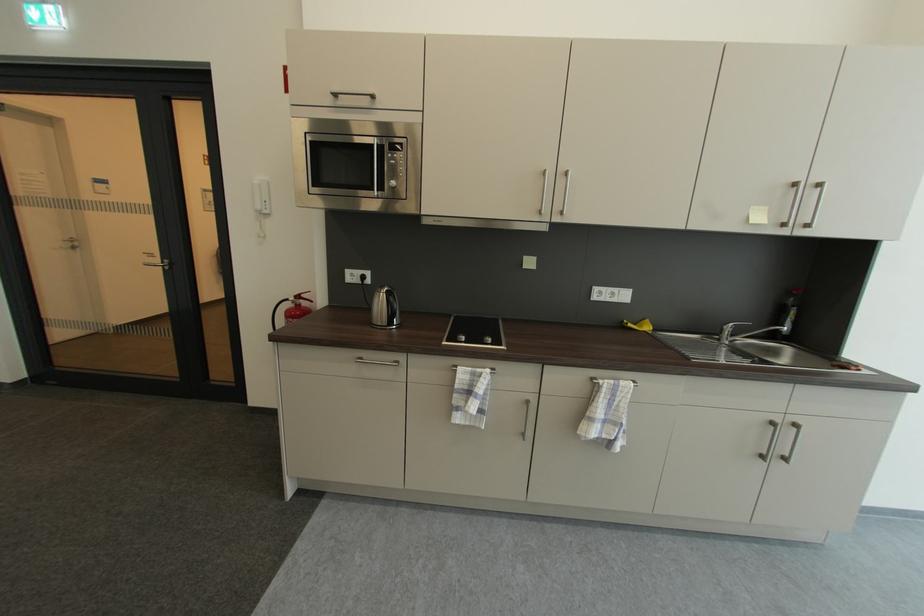
The height and width of the screenshot is (616, 924). I want to click on microwave control button, so click(392, 184).